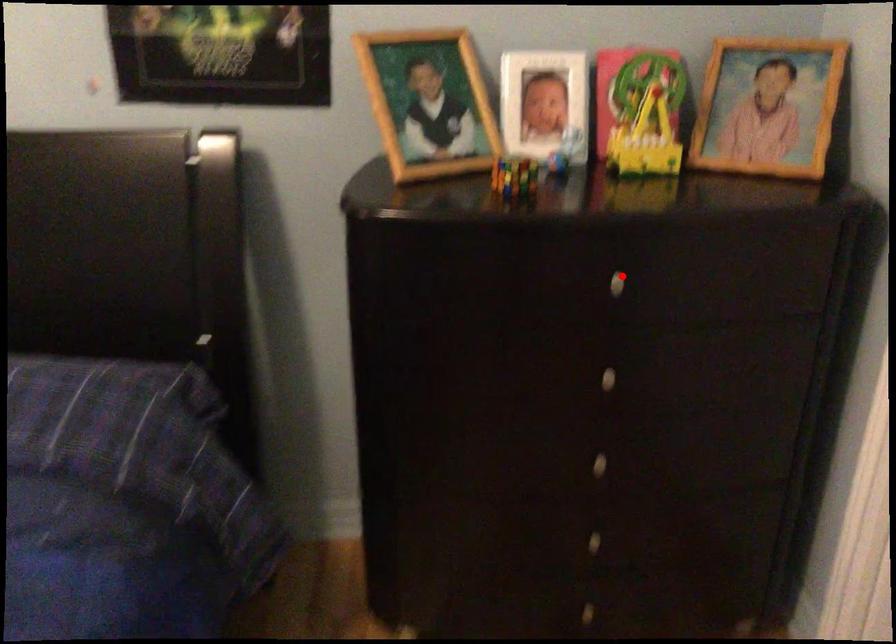
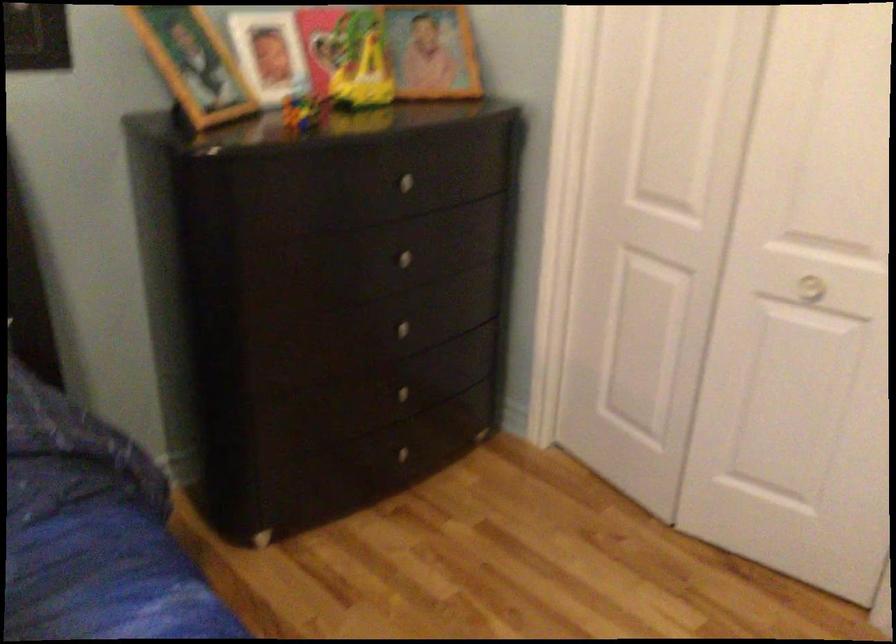
The point at the highlighted location is marked in the first image. Where is the corresponding point in the second image?

(408, 178)